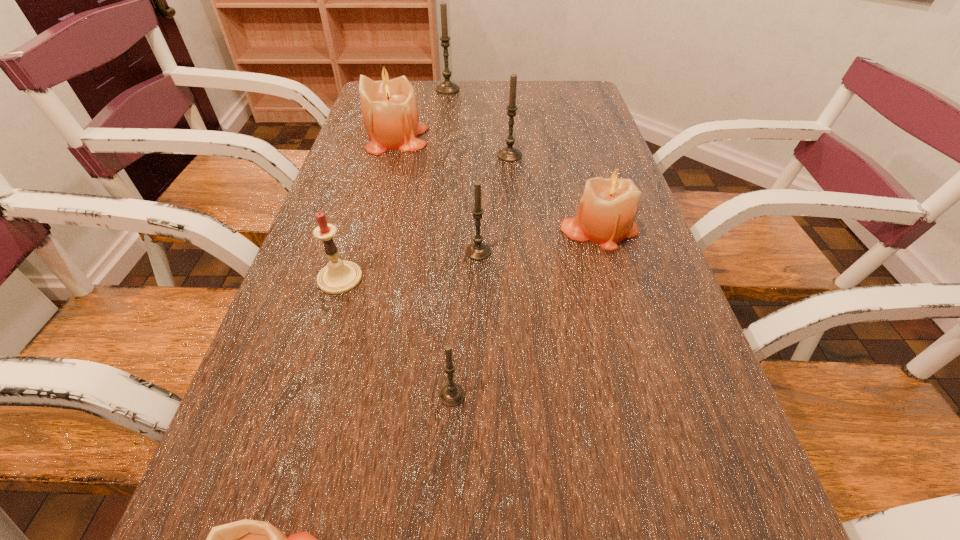
Where is `the farthest gray candle`? Image resolution: width=960 pixels, height=540 pixels. the farthest gray candle is located at coordinates (447, 87).

Locate an element on the screen. The height and width of the screenshot is (540, 960). the tallest object is located at coordinates (447, 87).

Where is `the second object from right to left`? the second object from right to left is located at coordinates (509, 154).

The image size is (960, 540). In order to click on the seventh candle from left to right in this screenshot , I will do click(x=509, y=154).

Find the location of a particular element. The image size is (960, 540). the biggest beige candle is located at coordinates (389, 108).

Find the location of a particular element. This screenshot has width=960, height=540. the second smallest gray candle is located at coordinates (477, 251).

You are a GUI agent. You are given a task and a screenshot of the screen. Output one action in this format:
    pyautogui.click(x=<x>, y=<y>)
    Task: Click on the red candle
    The width and height of the screenshot is (960, 540).
    Given the screenshot: What is the action you would take?
    pyautogui.click(x=338, y=277)

Find the location of a particular element. Image resolution: width=960 pixels, height=540 pixels. the sixth farthest candle is located at coordinates (338, 277).

The width and height of the screenshot is (960, 540). What are the coordinates of `the second biggest beige candle` in the screenshot? It's located at (609, 205).

The height and width of the screenshot is (540, 960). I want to click on the second farthest beige candle, so click(x=609, y=205).